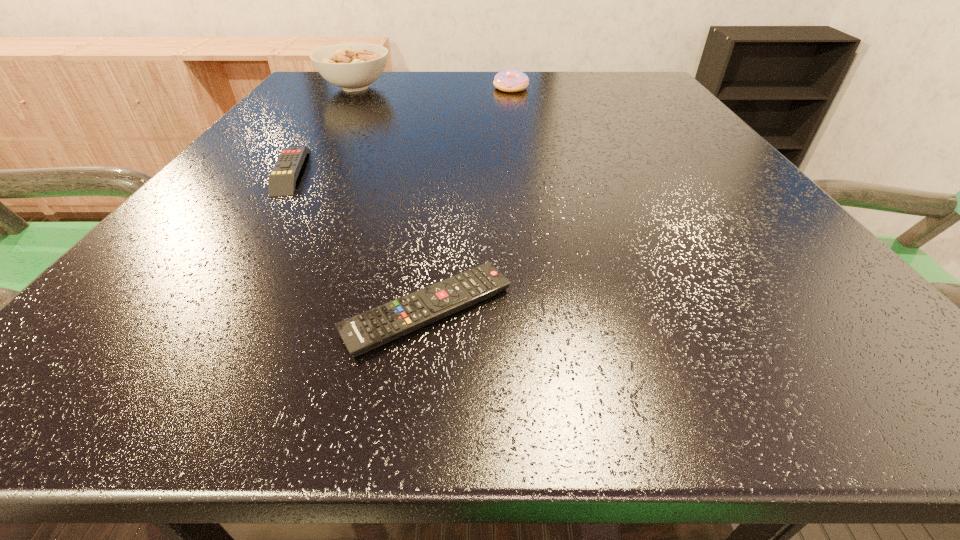
You are a GUI agent. You are given a task and a screenshot of the screen. Output one action in this format:
    pyautogui.click(x=<x>, y=<y>)
    Task: Click on the free space between the left remote control and the right remote control
    
    Given the screenshot: What is the action you would take?
    pyautogui.click(x=360, y=241)

Identify the location of free space that is in between the third shortest object and the shortest object. This screenshot has height=540, width=960. (469, 199).

Identify which object is the third closest to the stew. Please provide its 2D coordinates. Your answer should be formatted as a tuple, i.e. [(x, y)], where the tuple contains the x and y coordinates of a point satisfying the conditions above.

[(366, 331)]

Image resolution: width=960 pixels, height=540 pixels. Find the location of `object that is the closest one to the second tallest object`. object that is the closest one to the second tallest object is located at coordinates (353, 66).

Find the location of a particular element. blank area in the image that satisfies the following two spatial constraints: 1. on the front side of the stew; 2. on the left side of the shorter remote control is located at coordinates (213, 310).

Find the location of a particular element. Image resolution: width=960 pixels, height=540 pixels. free location that satisfies the following two spatial constraints: 1. on the front side of the taller remote control; 2. on the left side of the nearest object is located at coordinates (197, 310).